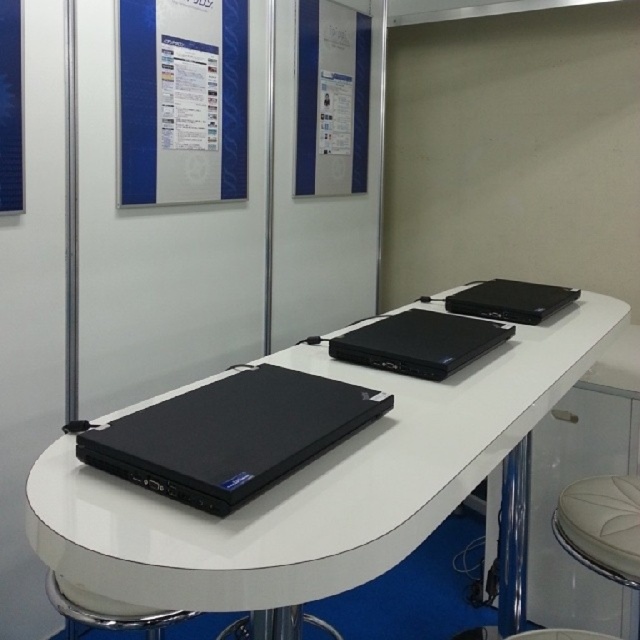
Between blue glossy poster at upper left and white leather bar stool at lower right, which one has less height?

white leather bar stool at lower right is shorter.

Locate an element on the screen. The width and height of the screenshot is (640, 640). blue glossy poster at upper left is located at coordinates [182, 100].

Between black matte laptop at center and white leather bar stool at lower left, which one is positioned higher?

black matte laptop at center is above.

Who is more distant from viewer, (392, 358) or (145, 620)?

The point (392, 358) is more distant.

Is point (400, 317) less distant than point (49, 596)?

No, (400, 317) is further to viewer.

This screenshot has height=640, width=640. Identify the location of black matte laptop at center. (419, 342).

Is white leather bar stool at lower right wider than white leather bar stool at lower left?

Incorrect, white leather bar stool at lower right's width does not surpass white leather bar stool at lower left's.

Can you confirm if white leather bar stool at lower right is positioned to the left of white leather bar stool at lower left?

Incorrect, white leather bar stool at lower right is not on the left side of white leather bar stool at lower left.

Locate an element on the screen. white leather bar stool at lower right is located at coordinates (602, 528).